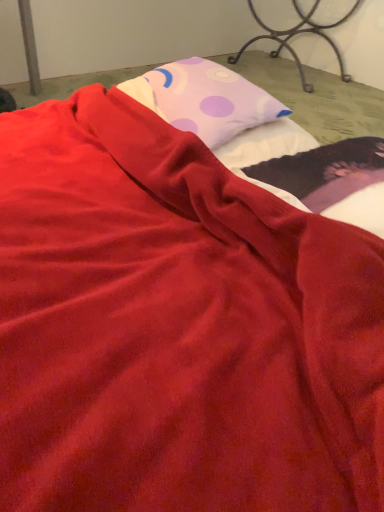
Question: Based on their sizes in the image, would you say matte pink pillow at upper center is bigger or smaller than metallic wrought iron bed frame at upper right?

Choices:
 (A) small
 (B) big

Answer: (A)

Question: Does point (206, 118) appear closer or farther from the camera than point (288, 34)?

Choices:
 (A) closer
 (B) farther

Answer: (A)

Question: Looking at their shapes, would you say matte pink pillow at upper center is wider or thinner than metallic wrought iron bed frame at upper right?

Choices:
 (A) wide
 (B) thin

Answer: (B)

Question: Considering the positions of metallic wrought iron bed frame at upper right and matte pink pillow at upper center in the image, is metallic wrought iron bed frame at upper right wider or thinner than matte pink pillow at upper center?

Choices:
 (A) thin
 (B) wide

Answer: (B)

Question: Is metallic wrought iron bed frame at upper right spatially inside matte pink pillow at upper center, or outside of it?

Choices:
 (A) inside
 (B) outside

Answer: (B)

Question: Is point (291, 1) positioned closer to the camera than point (185, 73)?

Choices:
 (A) farther
 (B) closer

Answer: (A)

Question: From the image's perspective, is metallic wrought iron bed frame at upper right positioned above or below matte pink pillow at upper center?

Choices:
 (A) below
 (B) above

Answer: (B)